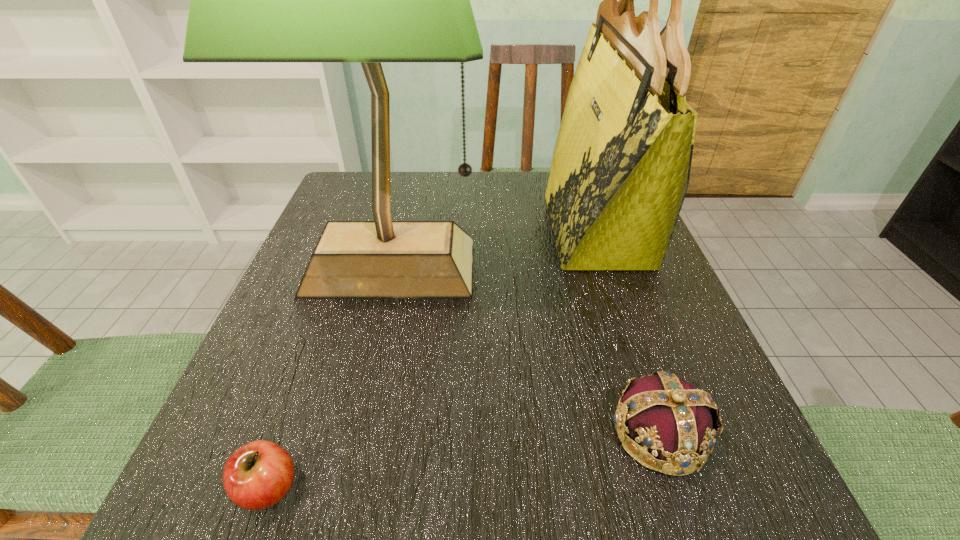
In order to click on vacant region between the second shortest object and the table lamp in this screenshot , I will do `click(525, 350)`.

This screenshot has height=540, width=960. In order to click on free area in between the tote bag and the second shortest object in this screenshot , I will do `click(628, 331)`.

Where is `empty location between the shortest object and the tote bag`? empty location between the shortest object and the tote bag is located at coordinates (433, 359).

This screenshot has height=540, width=960. I want to click on empty space that is in between the third tallest object and the table lamp, so click(x=525, y=350).

This screenshot has height=540, width=960. In order to click on vacant space that's between the tote bag and the second shortest object in this screenshot , I will do `click(628, 331)`.

You are a GUI agent. You are given a task and a screenshot of the screen. Output one action in this format:
    pyautogui.click(x=<x>, y=<y>)
    Task: Click on the free spot between the tote bag and the shortest object
    The image size is (960, 540).
    Given the screenshot: What is the action you would take?
    pyautogui.click(x=433, y=359)

The image size is (960, 540). Find the location of `object that stands as the closest to the table lamp`. object that stands as the closest to the table lamp is located at coordinates (620, 171).

The width and height of the screenshot is (960, 540). I want to click on object that is the third closest to the second shortest object, so click(x=258, y=475).

The height and width of the screenshot is (540, 960). Identify the location of vacant space that satisfies the following two spatial constraints: 1. on the front-facing side of the tote bag; 2. on the metallic stand of the table lamp. (610, 266).